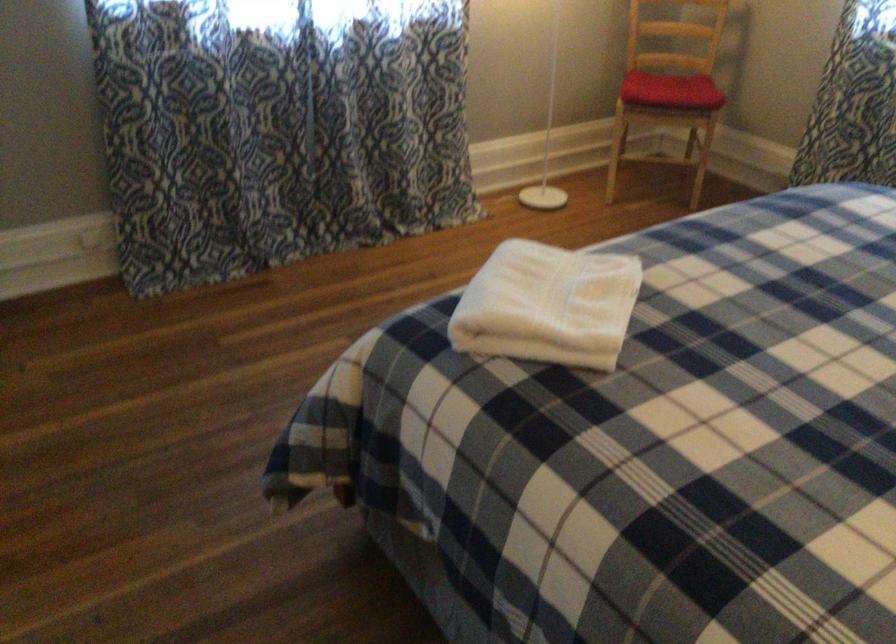
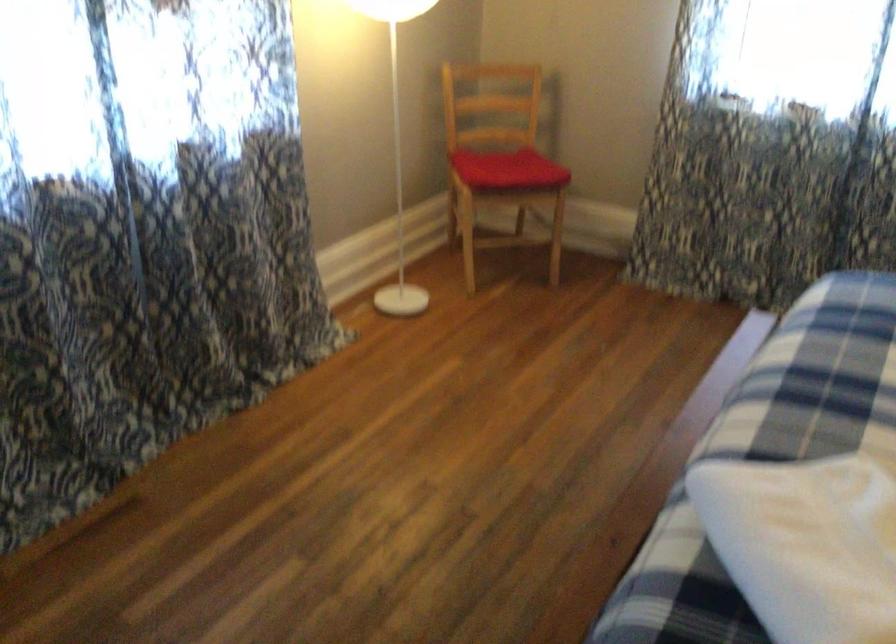
Find the pixel in the second image that matches (668,84) in the first image.

(507, 169)